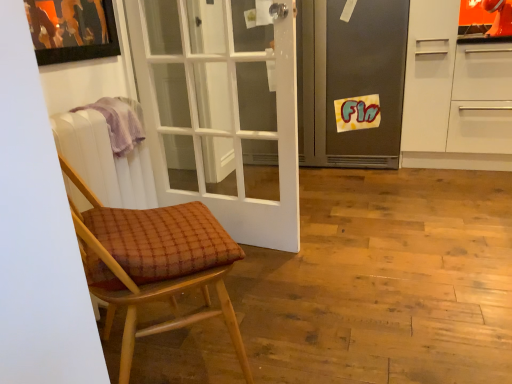
Find the location of a particular element. brown woven cushion at left is located at coordinates (154, 263).

Image resolution: width=512 pixels, height=384 pixels. Describe the element at coordinates (105, 161) in the screenshot. I see `white plastic radiator at left` at that location.

Locate an element on the screen. The image size is (512, 384). brown woven cushion at left is located at coordinates (154, 263).

Which object is thinner, metallic gray refrigerator at center or white plastic radiator at left?

With smaller width is white plastic radiator at left.

Is point (386, 50) more distant than point (78, 205)?

That is True.

How distant is metallic gray refrigerator at center from white plastic radiator at left?

metallic gray refrigerator at center is 5.96 feet from white plastic radiator at left.

What's the angular difference between metallic gray refrigerator at center and white plastic radiator at left's facing directions?

The facing directions of metallic gray refrigerator at center and white plastic radiator at left are 89.1 degrees apart.

From the picture: From the image's perspective, is purple cloth at left located above or below white plastic radiator at left?

purple cloth at left is situated higher than white plastic radiator at left in the image.

Is purple cloth at left taller than white plastic radiator at left?

In fact, purple cloth at left may be shorter than white plastic radiator at left.

I want to click on radiator below the purple cloth at left (from a real-world perspective), so click(105, 161).

Is purple cloth at left next to white plastic radiator at left and touching it?

No, purple cloth at left is not with white plastic radiator at left.

From a real-world perspective, does purple cloth at left sit lower than metallic gray refrigerator at center?

Incorrect, from a real-world perspective, purple cloth at left is higher than metallic gray refrigerator at center.

Between purple cloth at left and metallic gray refrigerator at center, which one appears on the right side from the viewer's perspective?

metallic gray refrigerator at center is more to the right.

In the image, is purple cloth at left positioned in front of or behind metallic gray refrigerator at center?

purple cloth at left is in front of metallic gray refrigerator at center.

Based on the photo, how far apart are purple cloth at left and metallic gray refrigerator at center?

purple cloth at left is 1.70 meters away from metallic gray refrigerator at center.

From a real-world perspective, is white plastic radiator at left located beneath brown woven cushion at left?

No.

Based on the photo, is white plastic radiator at left oriented towards brown woven cushion at left?

Result: Yes, white plastic radiator at left is oriented towards brown woven cushion at left.

Is the position of white plastic radiator at left less distant than that of brown woven cushion at left?

No, it is behind brown woven cushion at left.

Is white plastic radiator at left to the right of brown woven cushion at left from the viewer's perspective?

No.

Does metallic gray refrigerator at center have a greater height compared to purple cloth at left?

Yes.

Locate an element on the screen. screen door located behind the purple cloth at left is located at coordinates (366, 77).

Would you say purple cloth at left is part of metallic gray refrigerator at center's contents?

No.

How many degrees apart are the facing directions of metallic gray refrigerator at center and purple cloth at left?

The angular difference between metallic gray refrigerator at center and purple cloth at left is 89.6 degrees.

Considering the relative positions of brown woven cushion at left and white plastic radiator at left in the image provided, is brown woven cushion at left behind white plastic radiator at left?

No, it is in front of white plastic radiator at left.

Can you confirm if brown woven cushion at left is taller than white plastic radiator at left?

Yes.

Does point (225, 260) lie behind point (67, 120)?

No, it is in front of (67, 120).

Is brown woven cushion at left looking in the opposite direction of white plastic radiator at left?

No, brown woven cushion at left is not facing the opposite direction of white plastic radiator at left.

From the picture: From the image's perspective, is brown woven cushion at left positioned above or below metallic gray refrigerator at center?

brown woven cushion at left is below metallic gray refrigerator at center.

Can you confirm if brown woven cushion at left is smaller than metallic gray refrigerator at center?

Indeed, brown woven cushion at left has a smaller size compared to metallic gray refrigerator at center.

Is brown woven cushion at left positioned far away from metallic gray refrigerator at center?

Yes.

Consider the image. Is brown woven cushion at left situated inside metallic gray refrigerator at center or outside?

brown woven cushion at left lies outside metallic gray refrigerator at center.

Identify the location of screen door that appears on the right of white plastic radiator at left. Image resolution: width=512 pixels, height=384 pixels. (366, 77).

Find the location of a particular element. This screenshot has height=384, width=512. towel/napkin above the white plastic radiator at left (from a real-world perspective) is located at coordinates (120, 122).

Which object lies nearer to the anchor point purple cloth at left, metallic gray refrigerator at center or brown woven cushion at left?

brown woven cushion at left lies closer to purple cloth at left than the other object.

Looking at the image, which one is located closer to brown woven cushion at left, metallic gray refrigerator at center or white plastic radiator at left?

Based on the image, white plastic radiator at left appears to be nearer to brown woven cushion at left.

Which object lies further to the anchor point brown woven cushion at left, white plastic radiator at left or purple cloth at left?

purple cloth at left is further to brown woven cushion at left.

When comparing their distances from white plastic radiator at left, does brown woven cushion at left or purple cloth at left seem closer?

Among the two, purple cloth at left is located nearer to white plastic radiator at left.

Estimate the real-world distances between objects in this image. Which object is further from brown woven cushion at left, purple cloth at left or metallic gray refrigerator at center?

metallic gray refrigerator at center is positioned further to the anchor brown woven cushion at left.

Estimate the real-world distances between objects in this image. Which object is closer to metallic gray refrigerator at center, white plastic radiator at left or purple cloth at left?

purple cloth at left lies closer to metallic gray refrigerator at center than the other object.

Based on their spatial positions, is purple cloth at left or metallic gray refrigerator at center closer to white plastic radiator at left?

purple cloth at left is closer to white plastic radiator at left.

Which object lies nearer to the anchor point metallic gray refrigerator at center, purple cloth at left or brown woven cushion at left?

Based on the image, purple cloth at left appears to be nearer to metallic gray refrigerator at center.

The width and height of the screenshot is (512, 384). Identify the location of radiator between brown woven cushion at left and purple cloth at left in the front-back direction. (105, 161).

Locate an element on the screen. The height and width of the screenshot is (384, 512). towel/napkin between brown woven cushion at left and metallic gray refrigerator at center from front to back is located at coordinates (120, 122).

You are a GUI agent. You are given a task and a screenshot of the screen. Output one action in this format:
    pyautogui.click(x=<x>, y=<y>)
    Task: Click on the radiator located between brown woven cushion at left and metallic gray refrigerator at center in the depth direction
    
    Given the screenshot: What is the action you would take?
    pyautogui.click(x=105, y=161)

This screenshot has height=384, width=512. What are the coordinates of `towel/napkin positioned between white plastic radiator at left and metallic gray refrigerator at center from near to far` in the screenshot? It's located at pyautogui.click(x=120, y=122).